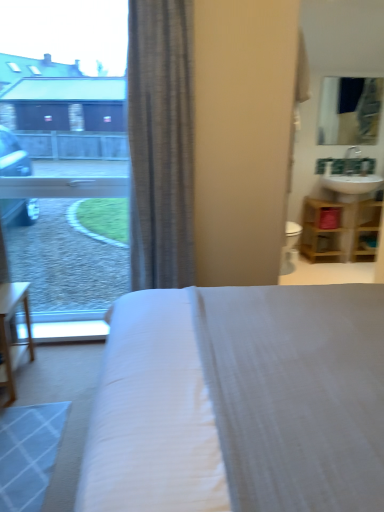
Locate an element on the screen. This screenshot has height=512, width=384. transparent glass window at upper left is located at coordinates (111, 160).

Measure the distance between transparent glass window at upper left and camera.

The depth of transparent glass window at upper left is 3.82 meters.

Locate an element on the screen. This screenshot has height=512, width=384. transparent glass window at upper left is located at coordinates (111, 160).

How different are the orientations of matte glass mirror at upper right and gray textured curtain at center in degrees?

The angle between the facing direction of matte glass mirror at upper right and the facing direction of gray textured curtain at center is 2.55 degrees.

From a real-world perspective, is matte glass mirror at upper right physically below gray textured curtain at center?

Incorrect, from a real-world perspective, matte glass mirror at upper right is higher than gray textured curtain at center.

Looking at this image, which of these two, matte glass mirror at upper right or gray textured curtain at center, is thinner?

matte glass mirror at upper right is thinner.

Is matte glass mirror at upper right not inside gray textured curtain at center?

Yes, matte glass mirror at upper right is outside of gray textured curtain at center.

Considering the positions of point (186, 297) and point (81, 81), is point (186, 297) closer or farther from the camera than point (81, 81)?

Point (186, 297).

Is white fabric bed at center not near transparent glass window at upper left?

Yes.

Considering the relative sizes of white fabric bed at center and transparent glass window at upper left in the image provided, is white fabric bed at center thinner than transparent glass window at upper left?

No, white fabric bed at center is not thinner than transparent glass window at upper left.

Can you confirm if matte glass mirror at upper right is wider than transparent glass window at upper left?

No, matte glass mirror at upper right is not wider than transparent glass window at upper left.

The width and height of the screenshot is (384, 512). In order to click on window in front of the matte glass mirror at upper right in this screenshot , I will do pos(111,160).

Does point (362, 104) lie in front of point (34, 270)?

Yes, point (362, 104) is in front of point (34, 270).

From a real-world perspective, is matte glass mirror at upper right on top of transparent glass window at upper left?

Yes, from a real-world perspective, matte glass mirror at upper right is on top of transparent glass window at upper left.

Between white fabric bed at center and wooden shelf at right, which one has larger width?

white fabric bed at center is wider.

This screenshot has height=512, width=384. In order to click on bed above the wooden shelf at right (from a real-world perspective) in this screenshot , I will do `click(240, 402)`.

From the image's perspective, is white fabric bed at center over wooden shelf at right?

No, from the image's perspective, white fabric bed at center is not on top of wooden shelf at right.

Is wooden shelf at right far away from matte glass mirror at upper right?

They are positioned close to each other.

Is wooden shelf at right facing away from matte glass mirror at upper right?

No, matte glass mirror at upper right is not at the back of wooden shelf at right.

Which is further, (330, 238) or (370, 90)?

The point (370, 90) is more distant.

From the image's perspective, which is below, wooden shelf at right or matte glass mirror at upper right?

wooden shelf at right appears lower in the image.

Considering the sizes of objects gray textured curtain at center and white fabric bed at center in the image provided, who is shorter, gray textured curtain at center or white fabric bed at center?

Standing shorter between the two is white fabric bed at center.

From the image's perspective, between gray textured curtain at center and white fabric bed at center, who is located below?

white fabric bed at center, from the image's perspective.

Would you say gray textured curtain at center is to the left or to the right of white fabric bed at center in the picture?

gray textured curtain at center is positioned on white fabric bed at center's left side.

Is white fabric bed at center facing towards matte glass mirror at upper right?

No, white fabric bed at center is not aimed at matte glass mirror at upper right.

Consider the image. From the image's perspective, which object appears higher, white fabric bed at center or matte glass mirror at upper right?

matte glass mirror at upper right, from the image's perspective.

Are white fabric bed at center and matte glass mirror at upper right far apart?

Absolutely, white fabric bed at center is distant from matte glass mirror at upper right.

Between white fabric bed at center and matte glass mirror at upper right, which one has less height?

matte glass mirror at upper right.

Where is `curtain in front of the matte glass mirror at upper right`? The height and width of the screenshot is (512, 384). curtain in front of the matte glass mirror at upper right is located at coordinates (160, 143).

Where is `window lying on the left of white fabric bed at center`? window lying on the left of white fabric bed at center is located at coordinates (111, 160).

When comparing their distances from gray textured curtain at center, does matte glass mirror at upper right or wooden shelf at right seem further?

matte glass mirror at upper right lies further to gray textured curtain at center than the other object.

Consider the image. Looking at the image, which one is located further to transparent glass window at upper left, wooden shelf at right or white fabric bed at center?

white fabric bed at center is further to transparent glass window at upper left.

Based on the photo, which object lies further to the anchor point transparent glass window at upper left, white fabric bed at center or matte glass mirror at upper right?

Among the two, white fabric bed at center is located further to transparent glass window at upper left.

Estimate the real-world distances between objects in this image. Which object is further from wooden shelf at right, transparent glass window at upper left or matte glass mirror at upper right?

transparent glass window at upper left lies further to wooden shelf at right than the other object.

From the image, which object appears to be farther from matte glass mirror at upper right, transparent glass window at upper left or wooden shelf at right?

Based on the image, transparent glass window at upper left appears to be further to matte glass mirror at upper right.

Looking at this image, considering their positions, is gray textured curtain at center positioned closer to transparent glass window at upper left than wooden shelf at right?

The object closer to transparent glass window at upper left is gray textured curtain at center.

Which object lies further to the anchor point gray textured curtain at center, transparent glass window at upper left or wooden shelf at right?

Among the two, transparent glass window at upper left is located further to gray textured curtain at center.

Looking at this image, considering their positions, is transparent glass window at upper left positioned closer to white fabric bed at center than gray textured curtain at center?

gray textured curtain at center is positioned closer to the anchor white fabric bed at center.

This screenshot has height=512, width=384. I want to click on shelf located between transparent glass window at upper left and matte glass mirror at upper right in the left-right direction, so click(x=339, y=230).

Where is `curtain between white fabric bed at center and matte glass mirror at upper right along the z-axis`? Image resolution: width=384 pixels, height=512 pixels. curtain between white fabric bed at center and matte glass mirror at upper right along the z-axis is located at coordinates (160, 143).

I want to click on curtain between white fabric bed at center and wooden shelf at right from front to back, so click(x=160, y=143).

Where is `window positioned between gray textured curtain at center and wooden shelf at right from near to far`? This screenshot has width=384, height=512. window positioned between gray textured curtain at center and wooden shelf at right from near to far is located at coordinates (111, 160).